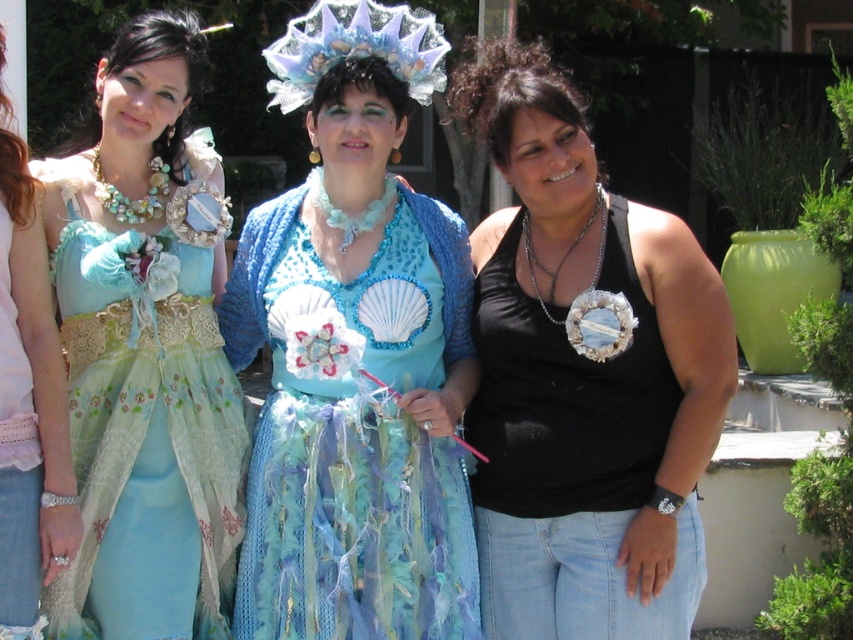
Is shiny blue fabric dress at center shorter than iridescent fabric headdress at center?

No.

Does point (263, 509) come behind point (409, 22)?

No.

Where is `shiny blue fabric dress at center`? The image size is (853, 640). shiny blue fabric dress at center is located at coordinates (355, 355).

Which is in front, point (547, 333) or point (4, 570)?

Positioned in front is point (4, 570).

Does point (585, 588) come closer to viewer compared to point (22, 368)?

That is False.

What do you see at coordinates (584, 378) in the screenshot?
I see `black matte tank top at center` at bounding box center [584, 378].

Find the location of a particular element. The height and width of the screenshot is (640, 853). black matte tank top at center is located at coordinates (584, 378).

Which of these two, matte blue dress at left or iridescent fabric headdress at center, stands shorter?

iridescent fabric headdress at center

Based on the photo, can you confirm if matte blue dress at left is positioned above iridescent fabric headdress at center?

No, matte blue dress at left is not above iridescent fabric headdress at center.

Which is behind, point (21, 198) or point (412, 36)?

Positioned behind is point (412, 36).

The image size is (853, 640). I want to click on matte blue dress at left, so click(28, 404).